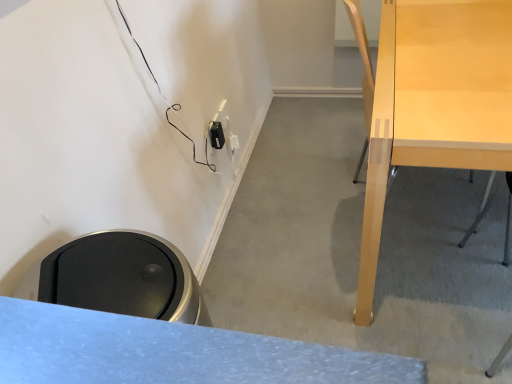
The image size is (512, 384). I want to click on free space below light wood desk at right (from a real-world perspective), so click(x=456, y=245).